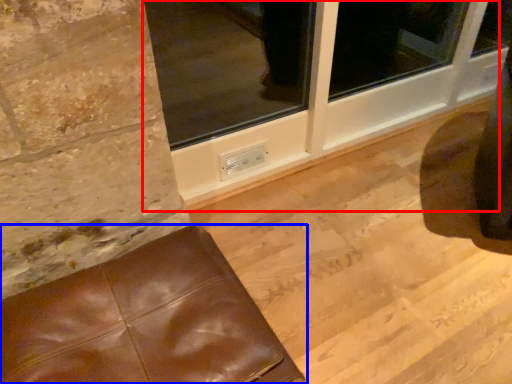
Question: Which point is closer to the camera, window frame (highlighted by a red box) or furniture (highlighted by a blue box)?

Choices:
 (A) window frame
 (B) furniture

Answer: (B)